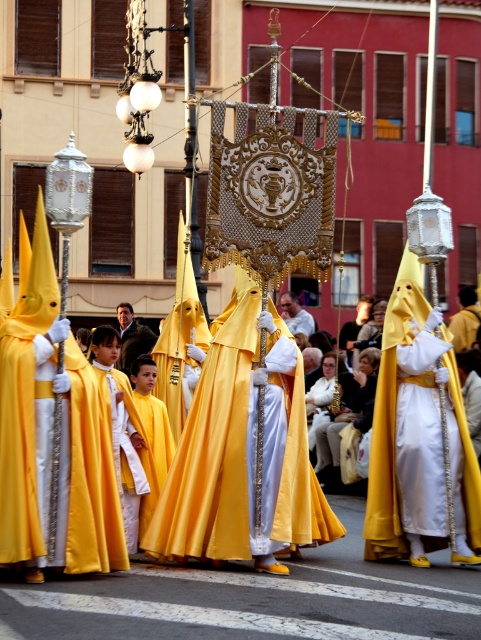
Who is more distant from viewer, [236,560] or [137,344]?

Positioned behind is point [137,344].

From the picture: Can you confirm if satin yellow robe at center is positioned below smooth brown coat at center?

Yes, satin yellow robe at center is below smooth brown coat at center.

Which is in front, point (267, 406) or point (131, 310)?

Point (267, 406) is more forward.

This screenshot has width=481, height=640. What are the coordinates of `satin yellow robe at center` in the screenshot? It's located at (241, 451).

Which is more to the left, matte gold robe at center or satin yellow robe at center?

Positioned to the left is matte gold robe at center.

I want to click on matte gold robe at center, so click(66, 472).

This screenshot has width=481, height=640. I want to click on matte gold robe at center, so click(66, 472).

Does matte gold robe at center come behind matte white robe at center?

That is False.

Between matte gold robe at center and matte white robe at center, which one has less height?

Standing shorter between the two is matte white robe at center.

Does point (112, 547) lie in front of point (283, 301)?

Yes, it is in front of point (283, 301).

At what (x,y) coordinates should I click in order to perform the action: click on matte gold robe at center. Please return your answer as a coordinate pair (x, y). Looking at the image, I should click on (66, 472).